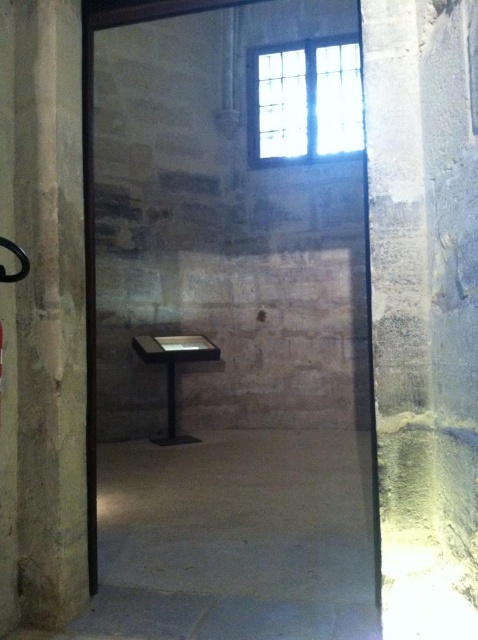
You are a tour guide leading a group through this corridor. You want to point out both the smooth stone pillar at left and the matte black table at center to your group. Which object is narrower in width?

The smooth stone pillar at left is thinner than the matte black table at center, so the smooth stone pillar at left is narrower in width.